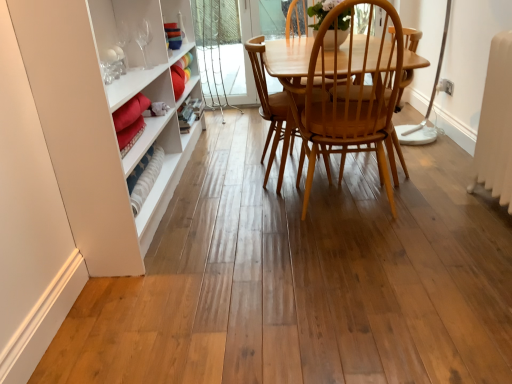
I want to click on free space below light brown wood chair at center (from a real-world perspective), so click(338, 211).